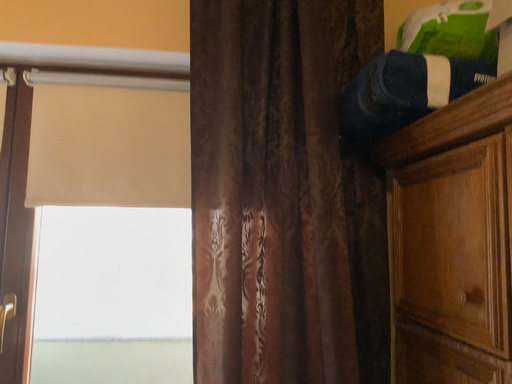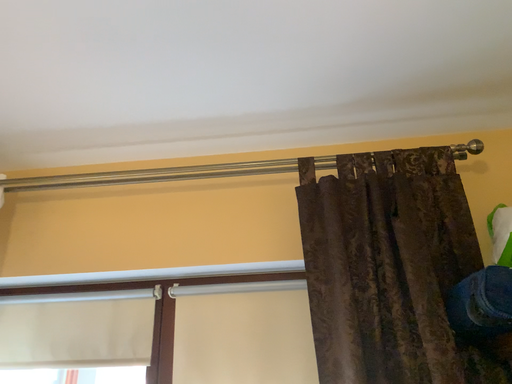
Question: Which way did the camera rotate in the video?

Choices:
 (A) rotated right
 (B) rotated left

Answer: (B)